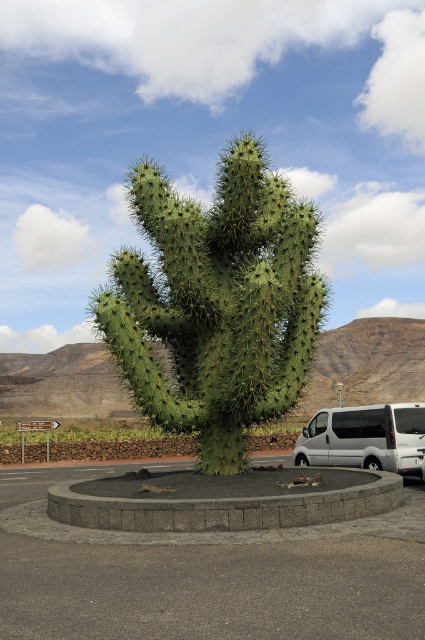
Who is shorter, gray concrete parking lot at center or green spiny cactus at center?

With less height is green spiny cactus at center.

Who is positioned more to the left, gray concrete parking lot at center or green spiny cactus at center?

gray concrete parking lot at center

This screenshot has height=640, width=425. I want to click on gray concrete parking lot at center, so click(x=204, y=573).

Identify the location of gray concrete parking lot at center. The width and height of the screenshot is (425, 640). (204, 573).

Who is more forward, (200, 256) or (376, 460)?

Point (200, 256)

Is green spiny cactus at center behind silver metallic van at center?

No, it is in front of silver metallic van at center.

This screenshot has height=640, width=425. What are the coordinates of `green spiny cactus at center` in the screenshot? It's located at (218, 301).

Identify the location of green spiny cactus at center. This screenshot has width=425, height=640. (218, 301).

Can you confirm if gray concrete parking lot at center is wider than silver metallic van at center?

Yes.

Does gray concrete parking lot at center appear on the right side of silver metallic van at center?

No, gray concrete parking lot at center is not to the right of silver metallic van at center.

Between point (384, 522) and point (333, 413), which one is positioned in front?

Point (384, 522)

Locate an element on the screen. gray concrete parking lot at center is located at coordinates (204, 573).